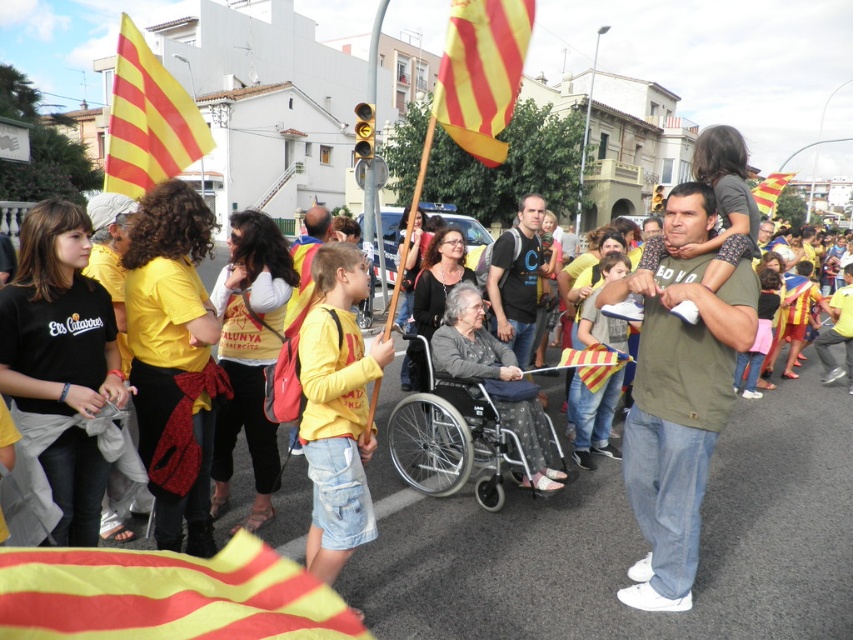
How much distance is there between yellowstriped fabricflag at upper center and yellowmaterial/textureflag at upper left?

2.15 meters

Does point (467, 88) come behind point (144, 172)?

No.

Identify the location of yellowstriped fabricflag at upper center. The width and height of the screenshot is (853, 640). (480, 72).

At what (x,y) coordinates should I click in order to perform the action: click on yellowstriped fabricflag at upper center. Please return your answer as a coordinate pair (x, y). This screenshot has height=640, width=853. Looking at the image, I should click on (480, 72).

Between silver metallic wheelchair at center and yellowmaterial/textureflag at upper left, which one has more height?

yellowmaterial/textureflag at upper left

Which is in front, point (492, 490) or point (164, 138)?

Positioned in front is point (164, 138).

At what (x,y) coordinates should I click in order to perform the action: click on silver metallic wheelchair at center. Please return your answer as a coordinate pair (x, y). The width and height of the screenshot is (853, 640). Looking at the image, I should click on (456, 436).

Looking at this image, is matte green t-shirt at center wider than yellow striped fabric at center?

Correct, the width of matte green t-shirt at center exceeds that of yellow striped fabric at center.

How far apart are matte green t-shirt at center and yellow striped fabric at center?

5.50 feet

Locate an element on the screen. Image resolution: width=853 pixels, height=640 pixels. matte green t-shirt at center is located at coordinates (677, 396).